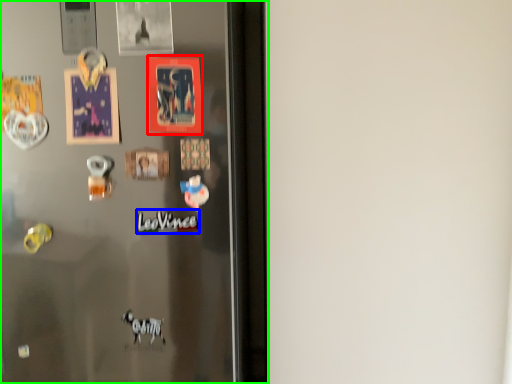
Question: Which object is positioned closest to postcard (highlighted by a red box)? Select from writing (highlighted by a blue box) and refrigerator (highlighted by a green box).

Choices:
 (A) writing
 (B) refrigerator

Answer: (A)